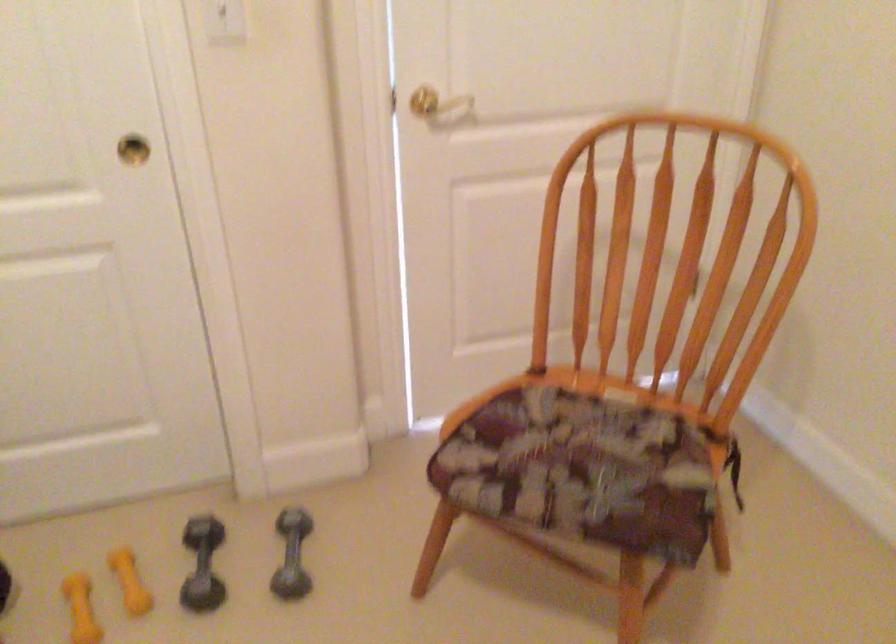
Find where to sit the chair sitting surface. Please return your answer as a coordinate pair (x, y).

(582, 469)